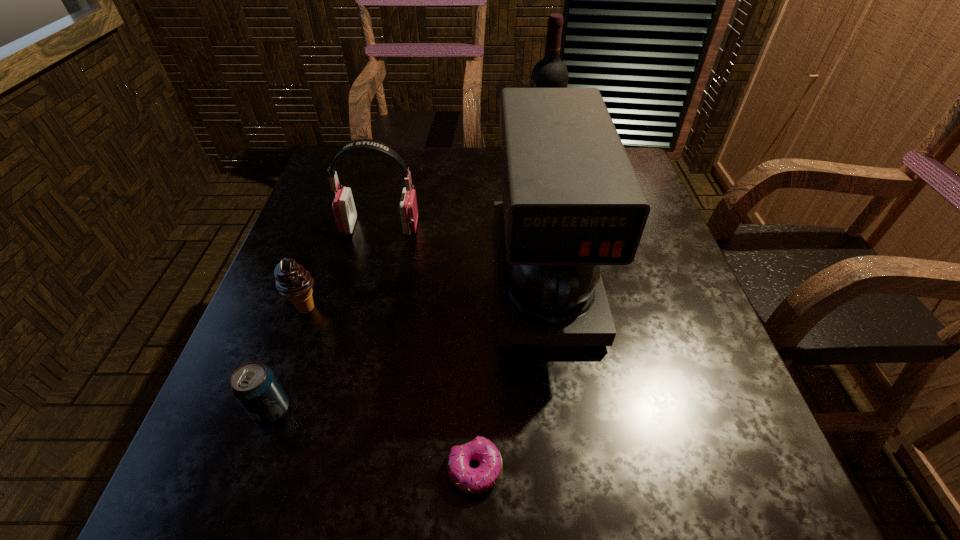
Where is `vacant space located on the label of the wine bottle`? Image resolution: width=960 pixels, height=540 pixels. vacant space located on the label of the wine bottle is located at coordinates (461, 158).

Image resolution: width=960 pixels, height=540 pixels. In order to click on vacant region located 0.060m on the carafe side of the second tallest object in this screenshot , I will do `click(559, 378)`.

In order to click on blank space located on the outer surface of the earphone in this screenshot , I will do `click(546, 227)`.

Locate an element on the screen. vacant space located 0.360m on the right of the fourth tallest object is located at coordinates (497, 308).

Locate an element on the screen. The height and width of the screenshot is (540, 960). vacant space located 0.180m on the back of the second nearest object is located at coordinates (305, 315).

At what (x,y) coordinates should I click in order to perform the action: click on vacant space located 0.330m on the left of the doughnut. Please return your answer as a coordinate pair (x, y). Looking at the image, I should click on (235, 469).

At what (x,y) coordinates should I click in order to perform the action: click on object that is at the far edge. Please return your answer as a coordinate pair (x, y). Looking at the image, I should click on click(550, 72).

This screenshot has width=960, height=540. I want to click on object present at the near edge, so click(x=469, y=480).

Where is `earphone that is at the left edge`? Image resolution: width=960 pixels, height=540 pixels. earphone that is at the left edge is located at coordinates (343, 206).

You are a GUI agent. You are given a task and a screenshot of the screen. Output one action in this format:
    pyautogui.click(x=<x>, y=<y>)
    Task: Click on the icecream positioned at the left edge
    The height and width of the screenshot is (540, 960).
    Given the screenshot: What is the action you would take?
    pyautogui.click(x=292, y=281)